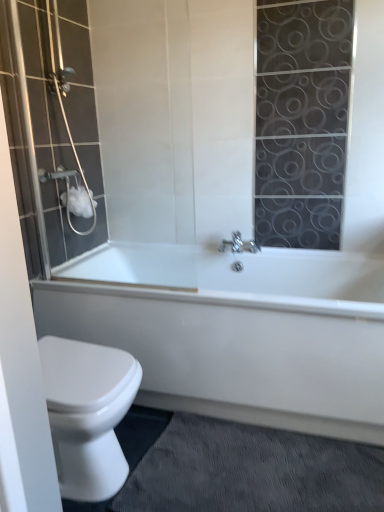
Question: Is white glossy bathtub at lower center bigger than gray textured bath mat at lower right?

Choices:
 (A) no
 (B) yes

Answer: (B)

Question: From a real-world perspective, is white glossy bathtub at lower center below gray textured bath mat at lower right?

Choices:
 (A) yes
 (B) no

Answer: (B)

Question: Would you say gray textured bath mat at lower right is part of white glossy bathtub at lower center's contents?

Choices:
 (A) yes
 (B) no

Answer: (B)

Question: Is white glossy bathtub at lower center completely or partially outside of gray textured bath mat at lower right?

Choices:
 (A) yes
 (B) no

Answer: (A)

Question: From the image's perspective, is white glossy bathtub at lower center located beneath gray textured bath mat at lower right?

Choices:
 (A) yes
 (B) no

Answer: (B)

Question: From the image's perspective, is white glossy bathtub at lower center positioned above or below white matte toilet paper at upper left?

Choices:
 (A) below
 (B) above

Answer: (A)

Question: From a real-world perspective, relative to white matte toilet paper at upper left, is white glossy bathtub at lower center vertically above or below?

Choices:
 (A) below
 (B) above

Answer: (A)

Question: Based on their sizes in the image, would you say white glossy bathtub at lower center is bigger or smaller than white matte toilet paper at upper left?

Choices:
 (A) big
 (B) small

Answer: (A)

Question: Choose the correct answer: Is white glossy bathtub at lower center inside white matte toilet paper at upper left or outside it?

Choices:
 (A) inside
 (B) outside

Answer: (B)

Question: In terms of height, does matte glass shower door at left look taller or shorter compared to gray textured bath mat at lower right?

Choices:
 (A) short
 (B) tall

Answer: (B)

Question: Is matte glass shower door at left to the left or to the right of gray textured bath mat at lower right in the image?

Choices:
 (A) right
 (B) left

Answer: (B)

Question: Based on their sizes in the image, would you say matte glass shower door at left is bigger or smaller than gray textured bath mat at lower right?

Choices:
 (A) small
 (B) big

Answer: (B)

Question: Is matte glass shower door at left wider or thinner than gray textured bath mat at lower right?

Choices:
 (A) wide
 (B) thin

Answer: (B)

Question: Considering the relative positions of white glossy bathtub at lower center and matte glass shower door at left in the image provided, is white glossy bathtub at lower center to the left or to the right of matte glass shower door at left?

Choices:
 (A) left
 (B) right

Answer: (B)

Question: From a real-world perspective, is white glossy bathtub at lower center physically located above or below matte glass shower door at left?

Choices:
 (A) above
 (B) below

Answer: (B)